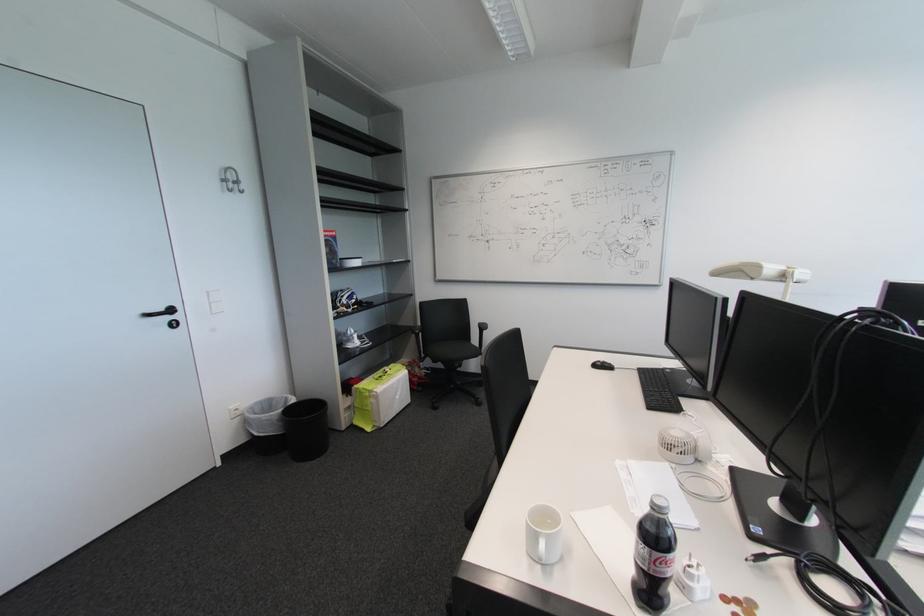
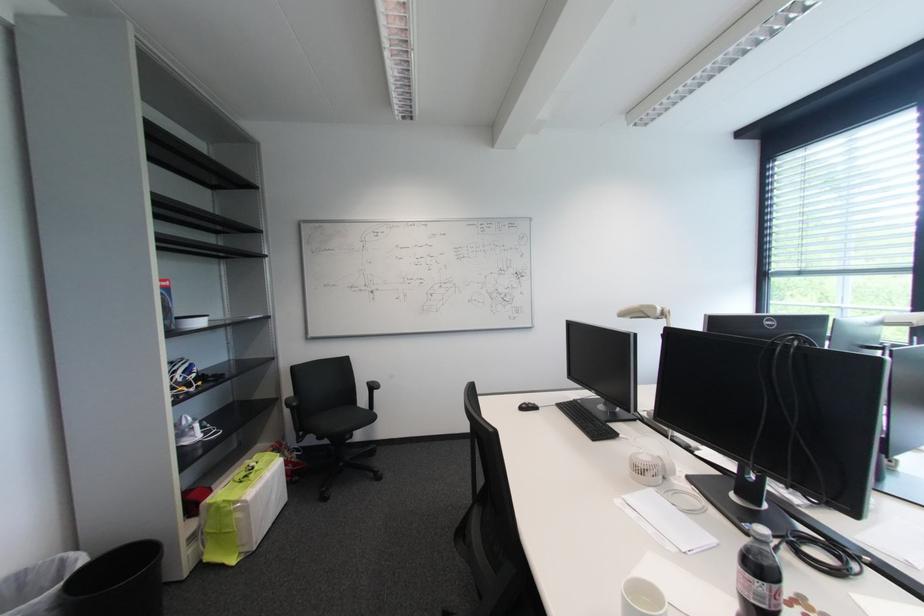
Where in the second image is the point corresponding to [298,402] from the first image?

(90, 562)